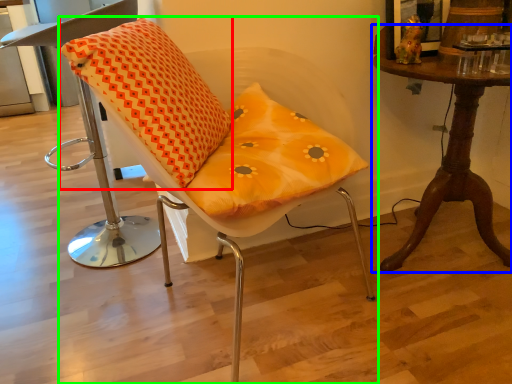
Question: Considering the real-world distances, which object is closest to throw pillow (highlighted by a red box)? table (highlighted by a blue box) or chair (highlighted by a green box).

Choices:
 (A) table
 (B) chair

Answer: (B)